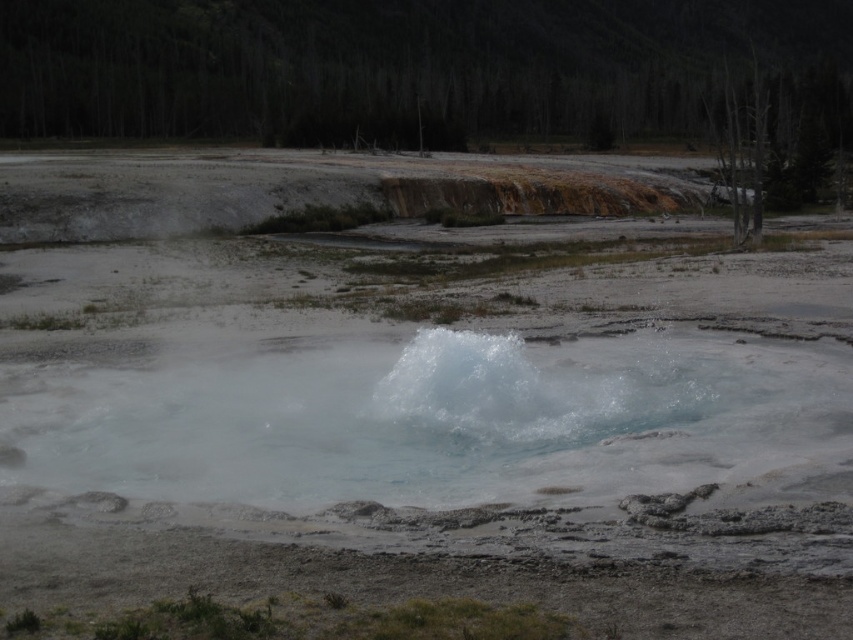
Who is more forward, (534, 426) or (474, 426)?

Point (474, 426) is in front.

Can you confirm if translucent white water at center is positioned to the right of translucent water vapor at center?

In fact, translucent white water at center is to the left of translucent water vapor at center.

Identify the location of translucent white water at center. (426, 417).